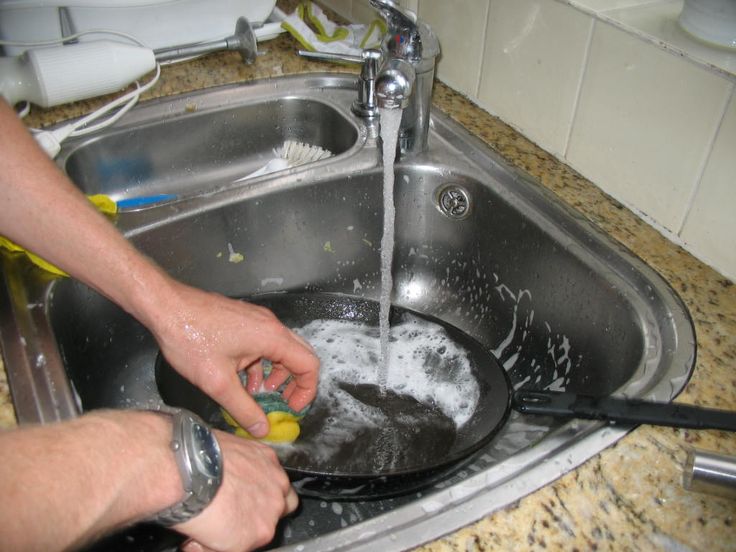
This screenshot has height=552, width=736. What are the coordinates of `skillet` in the screenshot? It's located at (371, 434).